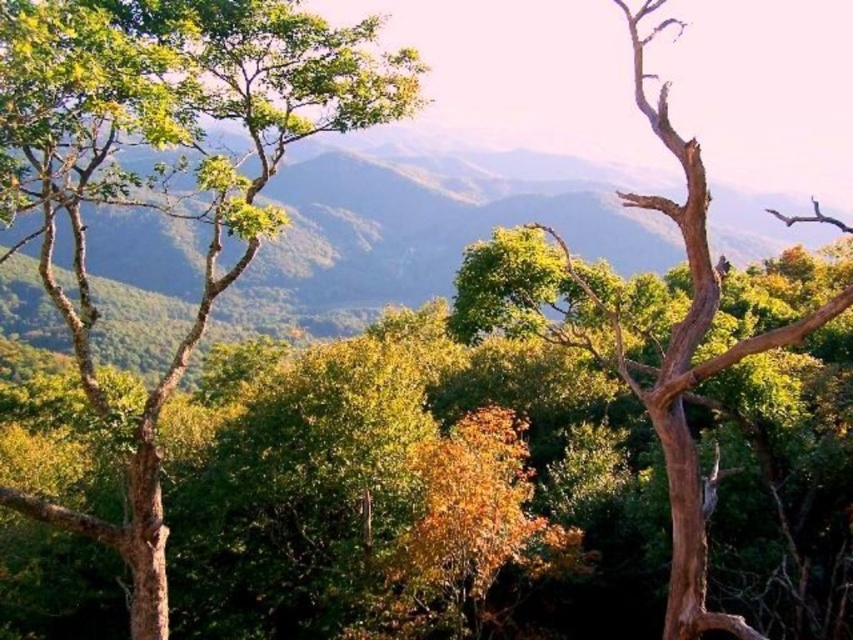
You are standing at the camera position and want to take a photo of the green matte tree at left. If your camera has a maximum focus range of 30 feet, will you be able to capture the tree clearly?

The green matte tree at left and camera are 30.93 feet apart, which exceeds the camera maximum focus range of 30 feet. Therefore, you won

Based on the scene description, where is the green matte tree at left located in terms of coordinates?

The green matte tree at left is located at coordinates point [169,170].

You are an explorer trying to reach the brown textured tree trunk at right. From your current position, which direction should you move to get closer to it without passing through the green leafy trees at left?

You should move to the right of the green leafy trees at left to reach the brown textured tree trunk at right since it is positioned behind them.